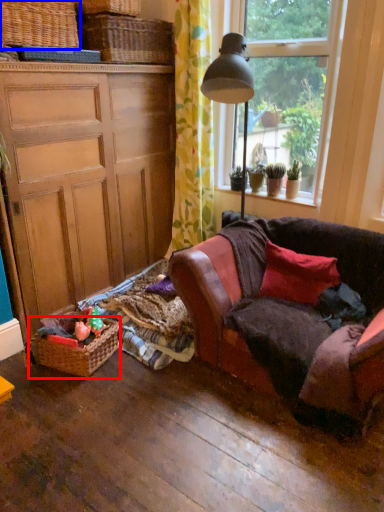
Question: Among these objects, which one is farthest to the camera, picnic basket (highlighted by a red box) or picnic basket (highlighted by a blue box)?

Choices:
 (A) picnic basket
 (B) picnic basket

Answer: (A)